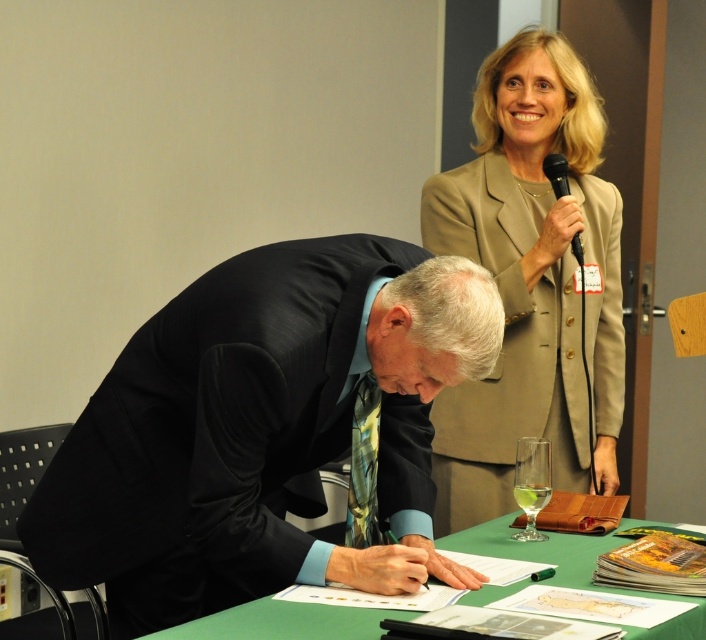
Question: Which point is closer to the camera?

Choices:
 (A) green matte table at lower center
 (B) clear glass wine glass at lower center
 (C) black silk suit at center
 (D) metallic silver microphone at upper right

Answer: (A)

Question: Can you confirm if black silk suit at center is positioned to the right of beige fabric suit at upper right?

Choices:
 (A) no
 (B) yes

Answer: (A)

Question: Considering the relative positions of clear glass wine glass at lower center and metallic silver microphone at upper right in the image provided, where is clear glass wine glass at lower center located with respect to metallic silver microphone at upper right?

Choices:
 (A) left
 (B) right

Answer: (A)

Question: Does black silk suit at center appear over clear glass wine glass at lower center?

Choices:
 (A) no
 (B) yes

Answer: (B)

Question: Which object is the closest to the green matte table at lower center?

Choices:
 (A) black silk suit at center
 (B) clear glass wine glass at lower center
 (C) beige fabric suit at upper right

Answer: (B)

Question: Which of the following is the farthest from the observer?

Choices:
 (A) (520, 305)
 (B) (532, 509)

Answer: (A)